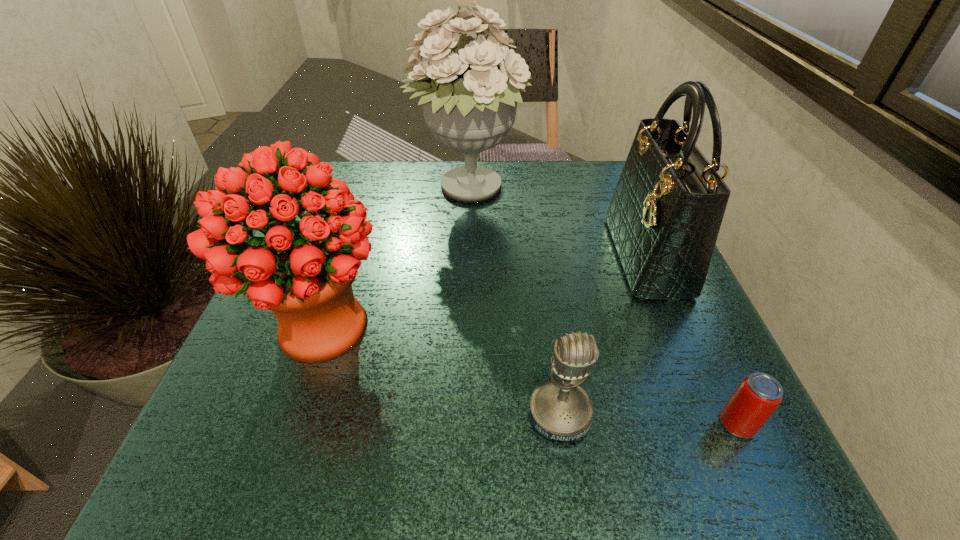
I want to click on vacant space located 0.240m on the back of the shorter bouquet, so click(363, 208).

I want to click on free point located on the back of the shortest object, so click(x=684, y=311).

You are a GUI agent. You are given a task and a screenshot of the screen. Output one action in this format:
    pyautogui.click(x=<x>, y=<y>)
    Task: Click on the object that is at the far edge
    
    Given the screenshot: What is the action you would take?
    pyautogui.click(x=470, y=108)

I want to click on microphone at the near edge, so click(x=561, y=410).

Find the location of `beer can present at the near edge`. beer can present at the near edge is located at coordinates (756, 398).

Where is `object located in the left edge section of the desktop`? object located in the left edge section of the desktop is located at coordinates coord(303,271).

The height and width of the screenshot is (540, 960). I want to click on handbag at the right edge, so click(x=665, y=214).

At what (x,y) coordinates should I click in order to perform the action: click on beer can located in the right edge section of the desktop. Please return your answer as a coordinate pair (x, y). Looking at the image, I should click on (756, 398).

The image size is (960, 540). I want to click on object that is positioned at the near right corner, so click(x=756, y=398).

Identify the location of vacant point at the far edge. The height and width of the screenshot is (540, 960). (427, 179).